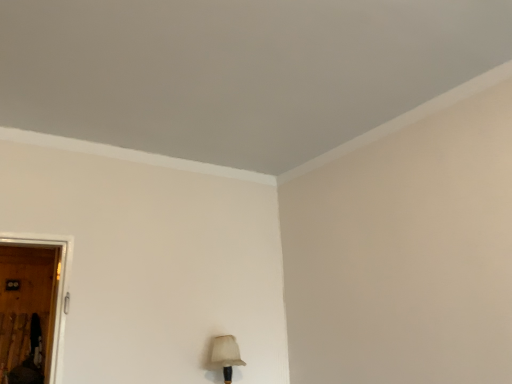
Image resolution: width=512 pixels, height=384 pixels. What do you see at coordinates (226, 355) in the screenshot?
I see `matte beige lampshade at lower center` at bounding box center [226, 355].

Identify the location of matte beige lampshade at lower center. The width and height of the screenshot is (512, 384). click(226, 355).

At what (x,y) coordinates should I click in order to perform the action: click on matte beige lampshade at lower center. Please return your answer as a coordinate pair (x, y). The image size is (512, 384). Looking at the image, I should click on [226, 355].